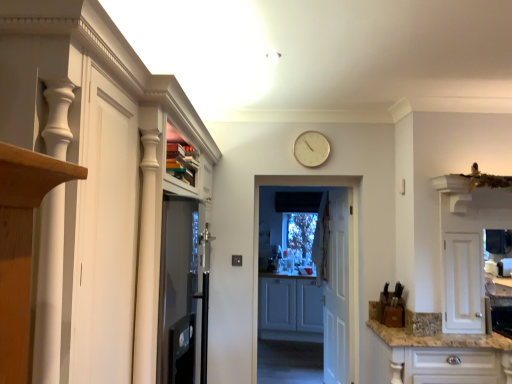
Locate an element on the screen. Image resolution: width=512 pixels, height=384 pixels. matte gray cabinets at center, the 3th cabinetry viewed from the front is located at coordinates (290, 309).

What is the approximate width of white wooden door at center, which is counted as the 2th door, starting from the back?

white wooden door at center, which is counted as the 2th door, starting from the back, is 3.50 inches in width.

What is the approximate height of white glossy cabinet at left, arranged as the third cabinetry when viewed from the right?

The height of white glossy cabinet at left, arranged as the third cabinetry when viewed from the right, is 6.13 feet.

Describe the element at coordinates (442, 357) in the screenshot. Image resolution: width=512 pixels, height=384 pixels. I see `white glossy cabinet at lower right, positioned as the second cabinetry in front-to-back order` at that location.

Locate an element on the screen. The width and height of the screenshot is (512, 384). white wooden door at center, which is counted as the second door, starting from the front is located at coordinates (336, 287).

Could you tell me if white glossy cabinet at lower right, positioned as the second cabinetry in front-to-back order, is facing white wooden door at center, which appears as the 1th door when viewed from the left?

No.

Is white wooden door at center, which ranks as the second door in right-to-left order, completely or partially inside white glossy cabinet at lower right, acting as the second cabinetry starting from the back?

No, white glossy cabinet at lower right, acting as the second cabinetry starting from the back, does not contain white wooden door at center, which ranks as the second door in right-to-left order.

Is white glossy cabinet at lower right, positioned as the second cabinetry in front-to-back order, in front of or behind white wooden door at center, which ranks as the second door in right-to-left order, in the image?

Visually, white glossy cabinet at lower right, positioned as the second cabinetry in front-to-back order, is located in front of white wooden door at center, which ranks as the second door in right-to-left order.

Is white glossy cabinet at lower right, acting as the second cabinetry starting from the back, bigger than white wooden door at center, which ranks as the second door in right-to-left order?

Yes, white glossy cabinet at lower right, acting as the second cabinetry starting from the back, is bigger than white wooden door at center, which ranks as the second door in right-to-left order.

Is white plastic clock at upper center wider than white wooden door at center, which appears as the 1th door when viewed from the left?

No, white plastic clock at upper center is not wider than white wooden door at center, which appears as the 1th door when viewed from the left.

Does white plastic clock at upper center appear on the right side of white wooden door at center, which is the first door from front to back?

Yes.

From a real-world perspective, is white plastic clock at upper center beneath white wooden door at center, which appears as the 1th door when viewed from the left?

No, from a real-world perspective, white plastic clock at upper center is not under white wooden door at center, which appears as the 1th door when viewed from the left.

Is the position of white plastic clock at upper center more distant than that of white wooden door at center, which ranks as the second door in right-to-left order?

No.

How different are the orientations of white plastic clock at upper center and white glossy cabinet at lower right, positioned as the second cabinetry in front-to-back order, in degrees?

There is a 0.658-degree angle between the facing directions of white plastic clock at upper center and white glossy cabinet at lower right, positioned as the second cabinetry in front-to-back order.

Considering the relative sizes of white plastic clock at upper center and white glossy cabinet at lower right, which is the 1th cabinetry from right to left, in the image provided, is white plastic clock at upper center smaller than white glossy cabinet at lower right, which is the 1th cabinetry from right to left,?

Yes.

Which of these two, white plastic clock at upper center or white glossy cabinet at lower right, positioned as the second cabinetry in front-to-back order, stands shorter?

Standing shorter between the two is white plastic clock at upper center.

Identify the location of clock above the white glossy cabinet at lower right, which is the 1th cabinetry from right to left (from the image's perspective). pyautogui.click(x=311, y=149).

Is white plastic clock at upper center far away from white wooden door at center, the 1th door when ordered from back to front?

Yes, white plastic clock at upper center and white wooden door at center, the 1th door when ordered from back to front, are located far from each other.

What's the angular difference between white plastic clock at upper center and white wooden door at center, which is counted as the second door, starting from the front,'s facing directions?

They differ by 83.7 degrees in their facing directions.

Is white plastic clock at upper center at the right side of white wooden door at center, which is the second door from left to right?

No, white plastic clock at upper center is not to the right of white wooden door at center, which is the second door from left to right.

Can we say white plastic clock at upper center lies outside white wooden door at center, which is counted as the second door, starting from the front?

Yes, white plastic clock at upper center is located beyond the bounds of white wooden door at center, which is counted as the second door, starting from the front.

Based on the photo, is matte gray cabinets at center, placed as the 2th cabinetry when sorted from right to left, taller or shorter than white glossy cabinet at lower right, the third cabinetry positioned from the left?

Considering their sizes, matte gray cabinets at center, placed as the 2th cabinetry when sorted from right to left, has more height than white glossy cabinet at lower right, the third cabinetry positioned from the left.

Is matte gray cabinets at center, placed as the 2th cabinetry when sorted from right to left, wider than white glossy cabinet at lower right, which is the 1th cabinetry from right to left?

No, matte gray cabinets at center, placed as the 2th cabinetry when sorted from right to left, is not wider than white glossy cabinet at lower right, which is the 1th cabinetry from right to left.

Does point (268, 295) come behind point (442, 379)?

Yes.

From the image's perspective, which object appears higher, matte gray cabinets at center, placed as the 2th cabinetry when sorted from right to left, or white glossy cabinet at lower right, which is the 1th cabinetry from right to left?

white glossy cabinet at lower right, which is the 1th cabinetry from right to left.

Is there a large distance between white wooden door at center, which is the second door from left to right, and white glossy cabinet at left, the 1th cabinetry in the front-to-back sequence?

Yes, white wooden door at center, which is the second door from left to right, and white glossy cabinet at left, the 1th cabinetry in the front-to-back sequence, are quite far apart.

Is white wooden door at center, which is counted as the second door, starting from the front, closer to the viewer compared to white glossy cabinet at left, which is the 3th cabinetry in back-to-front order?

No, white wooden door at center, which is counted as the second door, starting from the front, is behind white glossy cabinet at left, which is the 3th cabinetry in back-to-front order.

In order to click on cabinetry above the white wooden door at center, which is the second door from left to right (from the image's perspective) in this screenshot , I will do `click(95, 184)`.

Choose the correct answer: Is white wooden door at center, which appears as the first door when viewed from the right, inside white glossy cabinet at left, the 1th cabinetry in the front-to-back sequence, or outside it?

white wooden door at center, which appears as the first door when viewed from the right, is not inside white glossy cabinet at left, the 1th cabinetry in the front-to-back sequence, it's outside.

Considering the relative positions of white glossy cabinet at lower right, acting as the second cabinetry starting from the back, and white plastic clock at upper center in the image provided, is white glossy cabinet at lower right, acting as the second cabinetry starting from the back, to the left of white plastic clock at upper center from the viewer's perspective?

No.

Is point (388, 367) positioned in front of point (301, 152)?

Yes, it is in front of point (301, 152).

From the image's perspective, would you say white glossy cabinet at lower right, acting as the second cabinetry starting from the back, is positioned over white plastic clock at upper center?

No, from the image's perspective, white glossy cabinet at lower right, acting as the second cabinetry starting from the back, is not on top of white plastic clock at upper center.

Who is taller, white glossy cabinet at lower right, acting as the second cabinetry starting from the back, or white plastic clock at upper center?

white glossy cabinet at lower right, acting as the second cabinetry starting from the back, is taller.

Find the location of `the 2nd door above the white glossy cabinet at lower right, which is the 1th cabinetry from right to left (from a real-world perspective)`. the 2nd door above the white glossy cabinet at lower right, which is the 1th cabinetry from right to left (from a real-world perspective) is located at coordinates (258, 218).

The width and height of the screenshot is (512, 384). I want to click on door that is the 1st one below the white plastic clock at upper center (from a real-world perspective), so click(x=258, y=218).

Based on their spatial positions, is white plastic clock at upper center or white wooden door at center, which is counted as the 2th door, starting from the back, closer to white glossy cabinet at left, arranged as the third cabinetry when viewed from the right?

white wooden door at center, which is counted as the 2th door, starting from the back, is positioned closer to the anchor white glossy cabinet at left, arranged as the third cabinetry when viewed from the right.

Looking at the image, which one is located further to white wooden door at center, which is counted as the 2th door, starting from the back, white glossy cabinet at left, arranged as the third cabinetry when viewed from the right, or white wooden door at center, which is counted as the second door, starting from the front?

white glossy cabinet at left, arranged as the third cabinetry when viewed from the right, is further to white wooden door at center, which is counted as the 2th door, starting from the back.

Looking at this image, from the image, which object appears to be farther from white plastic clock at upper center, white wooden door at center, which appears as the 1th door when viewed from the left, or matte gray cabinets at center, arranged as the 2th cabinetry when viewed from the left?

matte gray cabinets at center, arranged as the 2th cabinetry when viewed from the left, is further to white plastic clock at upper center.

In the scene shown: Which object lies nearer to the anchor point white plastic clock at upper center, white glossy cabinet at left, which is the 3th cabinetry in back-to-front order, or white wooden door at center, which is counted as the 2th door, starting from the back?

white wooden door at center, which is counted as the 2th door, starting from the back, is closer to white plastic clock at upper center.

From the image, which object appears to be farther from white glossy cabinet at left, the first cabinetry in the left-to-right sequence, white glossy cabinet at lower right, positioned as the second cabinetry in front-to-back order, or matte gray cabinets at center, the 3th cabinetry viewed from the front?

matte gray cabinets at center, the 3th cabinetry viewed from the front.

In the scene shown: Based on their spatial positions, is white plastic clock at upper center or white wooden door at center, which appears as the first door when viewed from the right, further from white glossy cabinet at left, which is the 3th cabinetry in back-to-front order?

white wooden door at center, which appears as the first door when viewed from the right, lies further to white glossy cabinet at left, which is the 3th cabinetry in back-to-front order, than the other object.

Looking at the image, which one is located closer to white glossy cabinet at left, arranged as the third cabinetry when viewed from the right, white glossy cabinet at lower right, which is the 1th cabinetry from right to left, or white wooden door at center, which ranks as the second door in right-to-left order?

white wooden door at center, which ranks as the second door in right-to-left order, is closer to white glossy cabinet at left, arranged as the third cabinetry when viewed from the right.

Which object lies further to the anchor point white plastic clock at upper center, white glossy cabinet at left, which is the 3th cabinetry in back-to-front order, or white glossy cabinet at lower right, the third cabinetry positioned from the left?

Among the two, white glossy cabinet at left, which is the 3th cabinetry in back-to-front order, is located further to white plastic clock at upper center.

At what (x,y) coordinates should I click in order to perform the action: click on clock between white glossy cabinet at left, the first cabinetry in the left-to-right sequence, and matte gray cabinets at center, placed as the 2th cabinetry when sorted from right to left, from front to back. Please return your answer as a coordinate pair (x, y). Looking at the image, I should click on (311, 149).

Image resolution: width=512 pixels, height=384 pixels. I want to click on clock between white glossy cabinet at left, arranged as the third cabinetry when viewed from the right, and white wooden door at center, which ranks as the second door in right-to-left order, along the z-axis, so click(311, 149).

At what (x,y) coordinates should I click in order to perform the action: click on cabinetry located between white glossy cabinet at left, the first cabinetry in the left-to-right sequence, and white plastic clock at upper center in the depth direction. Please return your answer as a coordinate pair (x, y). Looking at the image, I should click on (442, 357).

You are a GUI agent. You are given a task and a screenshot of the screen. Output one action in this format:
    pyautogui.click(x=<x>, y=<y>)
    Task: Click on the clock between white glossy cabinet at left, the first cabinetry in the left-to-right sequence, and white wooden door at center, which is the second door from left to right, from front to back
    This screenshot has width=512, height=384.
    Given the screenshot: What is the action you would take?
    pyautogui.click(x=311, y=149)